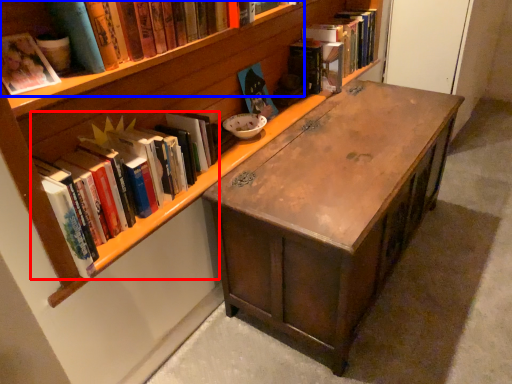
Question: Which object appears closest to the camera in this image, book (highlighted by a red box) or book (highlighted by a blue box)?

Choices:
 (A) book
 (B) book

Answer: (B)